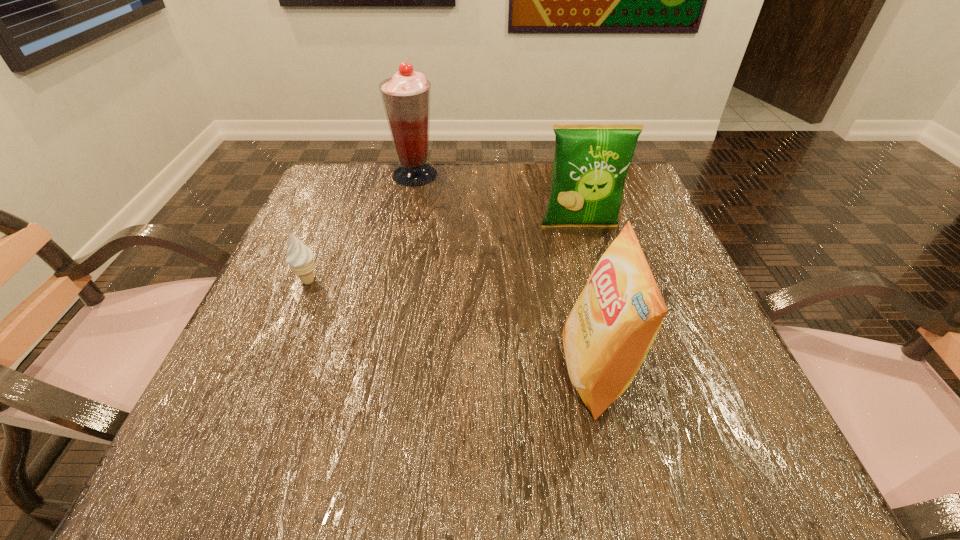
The image size is (960, 540). In order to click on free space located 0.320m on the front-facing side of the nearer crisp (potato chip) in this screenshot , I will do `click(357, 372)`.

This screenshot has width=960, height=540. In order to click on free space located 0.220m on the front-facing side of the icecream in this screenshot , I will do `click(262, 393)`.

Locate an element on the screen. Image resolution: width=960 pixels, height=540 pixels. object that is positioned at the far edge is located at coordinates (406, 97).

This screenshot has height=540, width=960. In order to click on object that is at the left edge in this screenshot , I will do `click(300, 257)`.

Where is `object that is at the right edge`? Image resolution: width=960 pixels, height=540 pixels. object that is at the right edge is located at coordinates (591, 161).

In the image, there is a desktop. Where is `blank space at the far edge`? blank space at the far edge is located at coordinates [442, 176].

The width and height of the screenshot is (960, 540). In order to click on vacant space at the near edge of the desktop in this screenshot , I will do pyautogui.click(x=427, y=452).

At what (x,y) coordinates should I click in order to perform the action: click on blank space at the left edge. Please return your answer as a coordinate pair (x, y). Looking at the image, I should click on tap(280, 317).

You are a GUI agent. You are given a task and a screenshot of the screen. Output one action in this format:
    pyautogui.click(x=<x>, y=<y>)
    Task: Click on the vacant space at the right edge
    Image resolution: width=960 pixels, height=540 pixels.
    Given the screenshot: What is the action you would take?
    pyautogui.click(x=673, y=367)

Where is `vacant space at the far left corner of the desktop`? Image resolution: width=960 pixels, height=540 pixels. vacant space at the far left corner of the desktop is located at coordinates (304, 207).